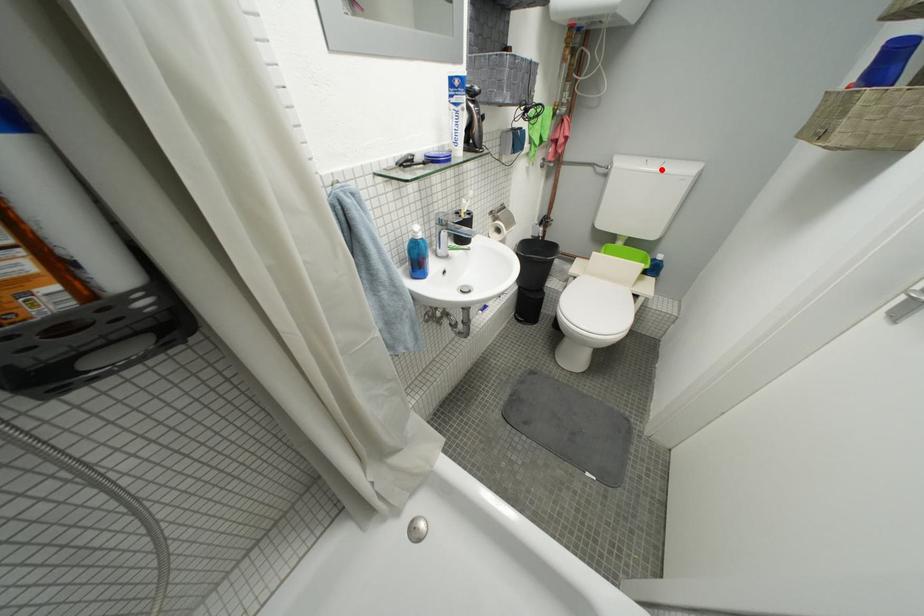
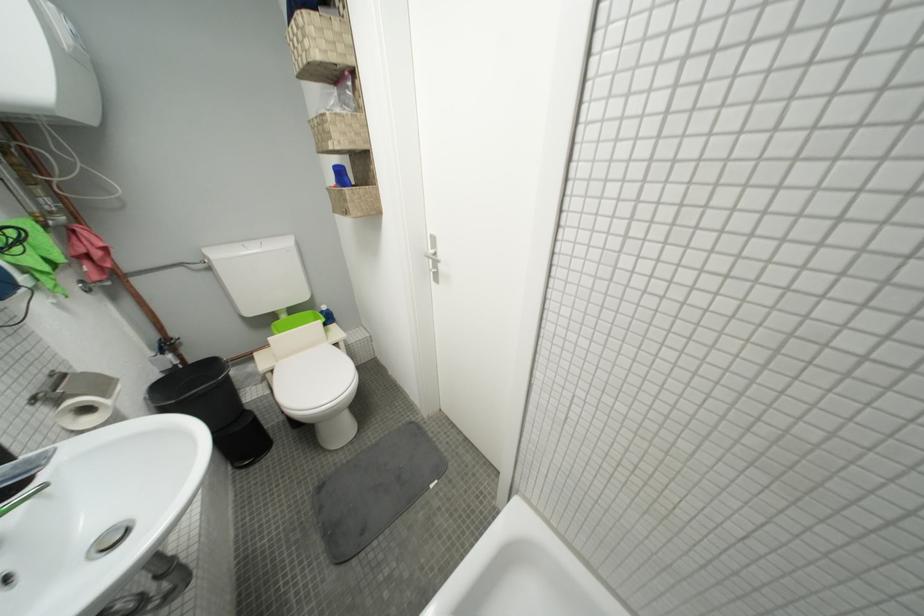
Locate, in the second image, the point that corresponds to the highlighted location in the first image.

(262, 252)